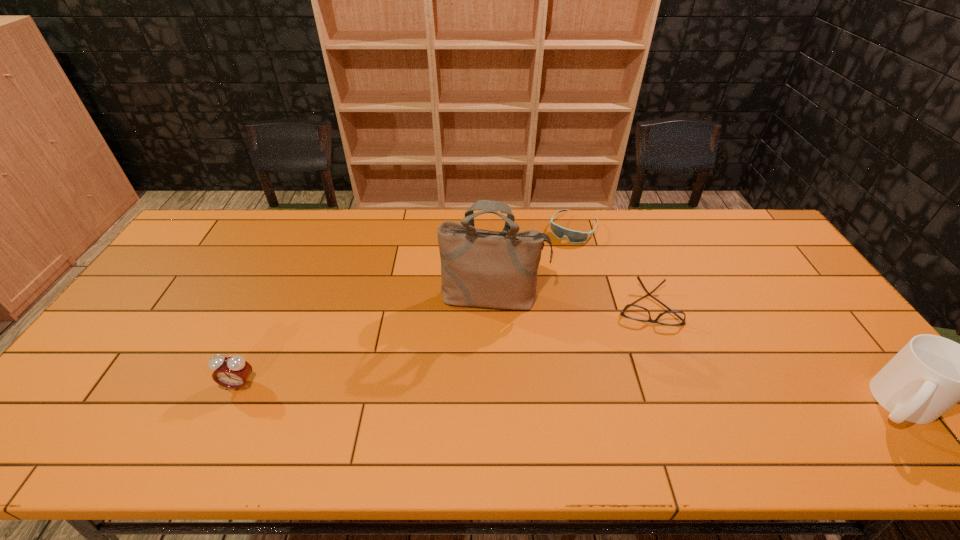
Identify the location of the third shortest object. (233, 372).

The height and width of the screenshot is (540, 960). I want to click on the leftmost object, so click(233, 372).

What are the coordinates of `goggles` in the screenshot? It's located at (573, 236).

You are a GUI agent. You are given a task and a screenshot of the screen. Output one action in this format:
    pyautogui.click(x=<x>, y=<y>)
    Task: Click on the tallest object
    The width and height of the screenshot is (960, 540).
    Given the screenshot: What is the action you would take?
    pyautogui.click(x=479, y=268)

The height and width of the screenshot is (540, 960). In order to click on shoulder bag in this screenshot , I will do `click(479, 268)`.

I want to click on spectacles, so click(635, 312).

Locate an element on the screen. Image resolution: width=960 pixels, height=540 pixels. vacant space situated 0.260m on the front-facing side of the farthest object is located at coordinates (533, 289).

Identify the location of vacant space positioned on the front-facing side of the farthest object. (532, 292).

The height and width of the screenshot is (540, 960). I want to click on blank area located on the front-facing side of the farthest object, so click(532, 292).

Image resolution: width=960 pixels, height=540 pixels. Find the location of `vacant region located 0.060m on the front-facing side of the tallest object`. vacant region located 0.060m on the front-facing side of the tallest object is located at coordinates (491, 332).